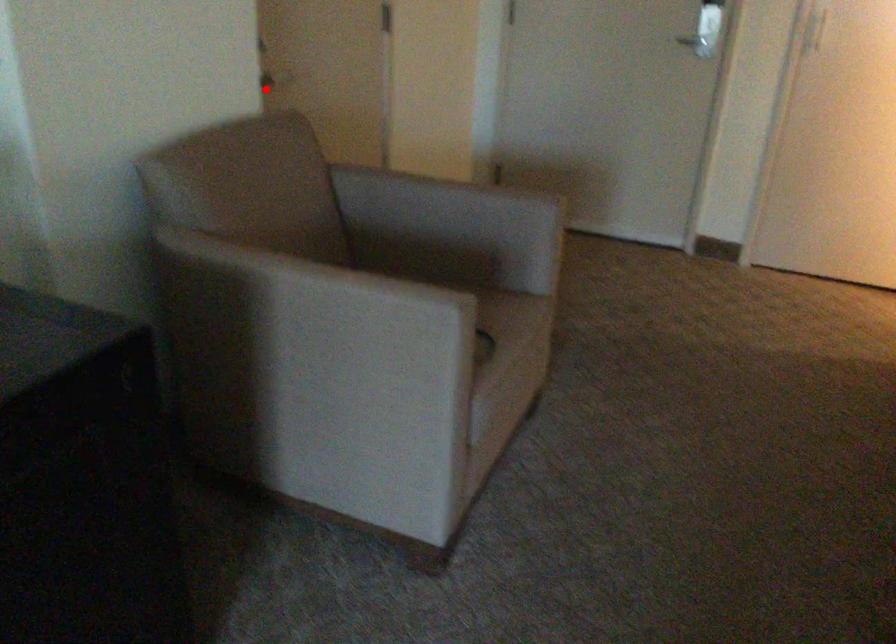
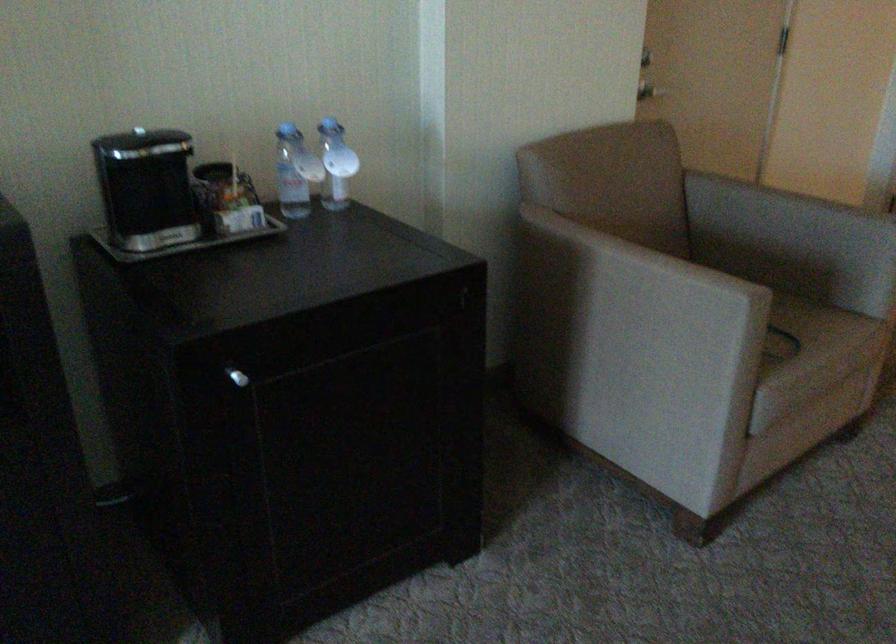
Question: I am providing you with two images of the same scene from different viewpoints. In image1, a red point is highlighted. Considering the same 3D point in image2, which of the following is correct?

Choices:
 (A) It is closer
 (B) It is farther

Answer: (B)